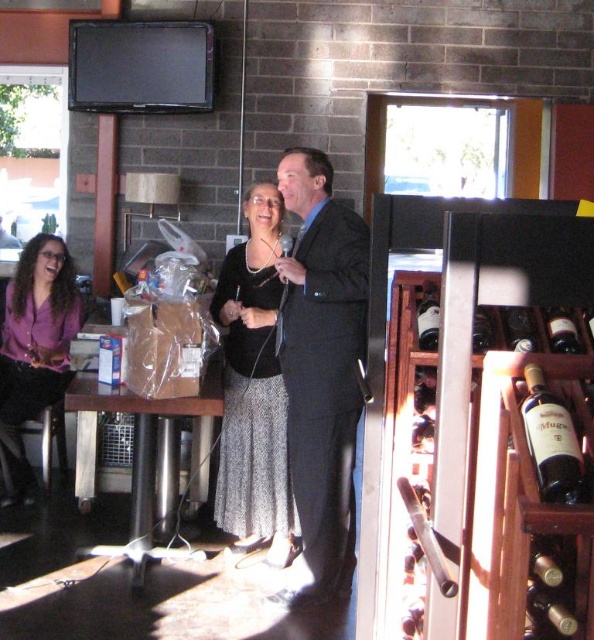
Question: Is silver metallic skirt at center further to the viewer compared to dark brown glass bottle at center right?

Choices:
 (A) yes
 (B) no

Answer: (A)

Question: Is wooden wine rack at right positioned at the back of matte brown bottle at right?

Choices:
 (A) yes
 (B) no

Answer: (B)

Question: From the image, what is the correct spatial relationship of wooden wine rack at right in relation to dark red glass bottle at center?

Choices:
 (A) right
 (B) left

Answer: (A)

Question: Which point is farther to the camera?

Choices:
 (A) (431, 285)
 (B) (337, 477)
 (C) (560, 625)
 (D) (516, 317)

Answer: (B)

Question: Which object is closer to the camera taking this photo?

Choices:
 (A) dark gray suit at center
 (B) silver metallic skirt at center

Answer: (A)

Question: Which of these objects is positioned closest to the dark red glass bottle at center?

Choices:
 (A) translucent glass wine bottle at center right
 (B) matte brown bottle at right
 (C) silver metallic skirt at center
 (D) purple matte blouse at left

Answer: (B)